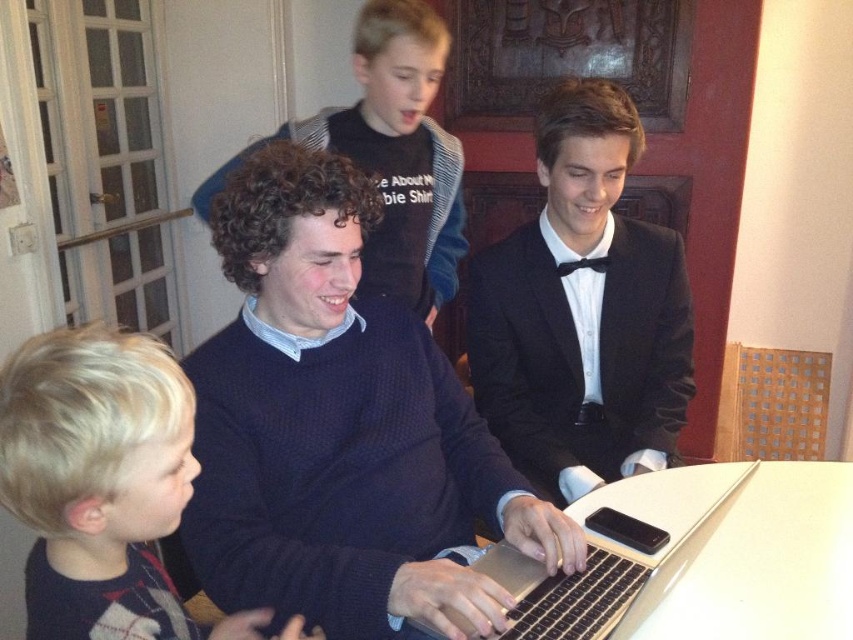
Question: Estimate the real-world distances between objects in this image. Which object is closer to the dark blue sweater at center?

Choices:
 (A) silver metallic laptop at center
 (B) blonde hair at lower left
 (C) black satin tuxedo at center

Answer: (A)

Question: In this image, where is black satin tuxedo at center located relative to blonde hair at lower left?

Choices:
 (A) right
 (B) left

Answer: (A)

Question: Does blonde hair at lower left appear on the right side of silver metallic laptop at center?

Choices:
 (A) no
 (B) yes

Answer: (A)

Question: Is dark blue sweater at center wider than silver metallic laptop at center?

Choices:
 (A) yes
 (B) no

Answer: (B)

Question: Which object is farther from the camera taking this photo?

Choices:
 (A) black satin tuxedo at center
 (B) blonde hair at lower left
 (C) silver metallic laptop at center

Answer: (A)

Question: Among these points, which one is nearest to the camera?

Choices:
 (A) (28, 458)
 (B) (573, 512)

Answer: (A)